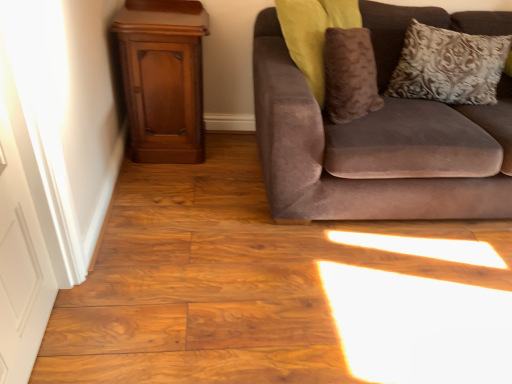
Question: Looking at their shapes, would you say mahogany wood dresser at left is wider or thinner than suede couch at right?

Choices:
 (A) thin
 (B) wide

Answer: (A)

Question: Is mahogany wood dresser at left to the left or to the right of suede couch at right in the image?

Choices:
 (A) right
 (B) left

Answer: (B)

Question: Based on their relative distances, which object is nearer to the silver textured pillow at upper right?

Choices:
 (A) suede couch at right
 (B) mahogany wood dresser at left
 (C) white painted wood door at left

Answer: (A)

Question: Considering the real-world distances, which object is farthest from the suede couch at right?

Choices:
 (A) mahogany wood dresser at left
 (B) silver textured pillow at upper right
 (C) white painted wood door at left

Answer: (C)